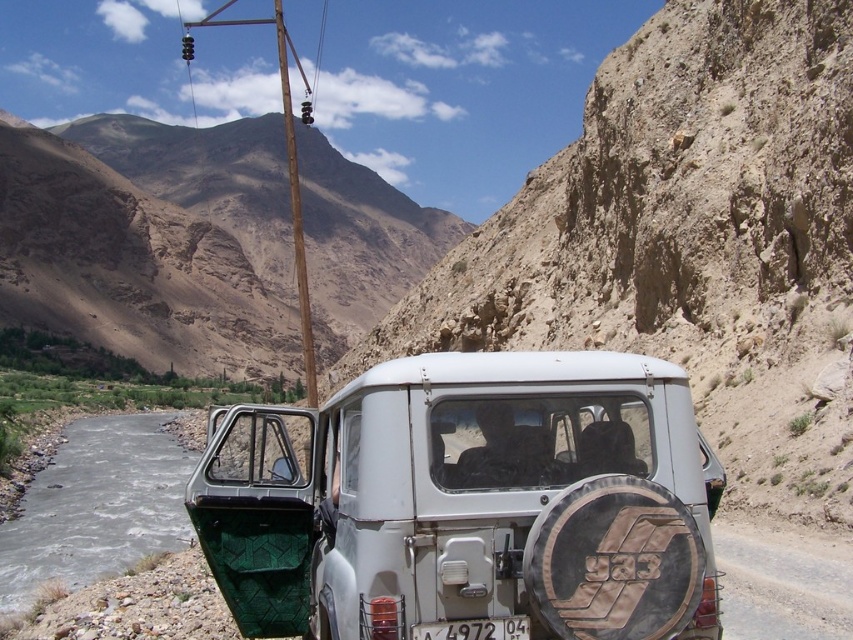
From the picture: Does gray rocky river at lower left have a greater height compared to brown wooden telegraph pole at upper center?

In fact, gray rocky river at lower left may be shorter than brown wooden telegraph pole at upper center.

Which is in front, point (105, 552) or point (309, 378)?

Positioned in front is point (309, 378).

Is point (26, 506) positioned in front of point (199, 20)?

Yes.

Locate an element on the screen. This screenshot has width=853, height=640. gray rocky river at lower left is located at coordinates (97, 506).

Can you confirm if white matte jeep at center is bigger than gray rocky river at lower left?

No.

Does white matte jeep at center have a smaller size compared to gray rocky river at lower left?

Yes, white matte jeep at center is smaller than gray rocky river at lower left.

Between point (297, 593) and point (91, 490), which one is positioned in front?

Point (297, 593) is more forward.

Where is `white matte jeep at center`? This screenshot has width=853, height=640. white matte jeep at center is located at coordinates (467, 500).

Is dull brown rock at upper center below gray rocky river at lower left?

Actually, dull brown rock at upper center is above gray rocky river at lower left.

Does dull brown rock at upper center have a lesser width compared to gray rocky river at lower left?

In fact, dull brown rock at upper center might be wider than gray rocky river at lower left.

Where is `dull brown rock at upper center`? The height and width of the screenshot is (640, 853). dull brown rock at upper center is located at coordinates (152, 240).